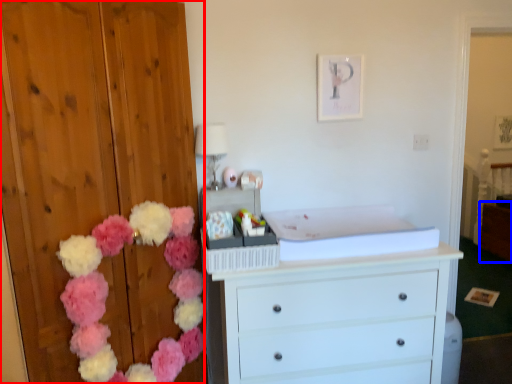
Question: Which of the following is the farthest to the observer, dresser (highlighted by a red box) or cabinetry (highlighted by a blue box)?

Choices:
 (A) dresser
 (B) cabinetry

Answer: (B)